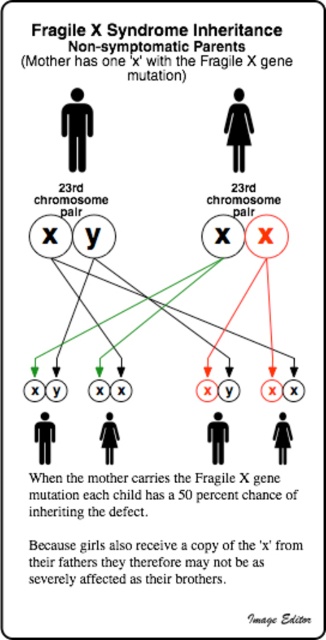
Is point (88, 115) positioned before point (285, 452)?

Yes.

Does black solid figure at center appear under matte black woman at lower right?

No.

Is point (90, 122) closer to camera compared to point (290, 436)?

Yes, point (90, 122) is closer to viewer.

Locate an element on the screen. The width and height of the screenshot is (326, 640). black solid figure at center is located at coordinates (76, 129).

Does point (80, 96) come behind point (48, 438)?

No, it is in front of (48, 438).

Who is more distant from viewer, (84, 170) or (43, 436)?

Point (84, 170)

Is point (69, 104) farther from viewer compared to point (44, 417)?

That is False.

This screenshot has width=326, height=640. What are the coordinates of `black solid figure at center` in the screenshot? It's located at (76, 129).

Looking at this image, does matte black figure at center have a larger size compared to matte black woman at center?

Indeed, matte black figure at center has a larger size compared to matte black woman at center.

Between point (226, 442) and point (107, 464), which one is positioned behind?

The point (107, 464) is more distant.

I want to click on matte black figure at center, so click(x=218, y=436).